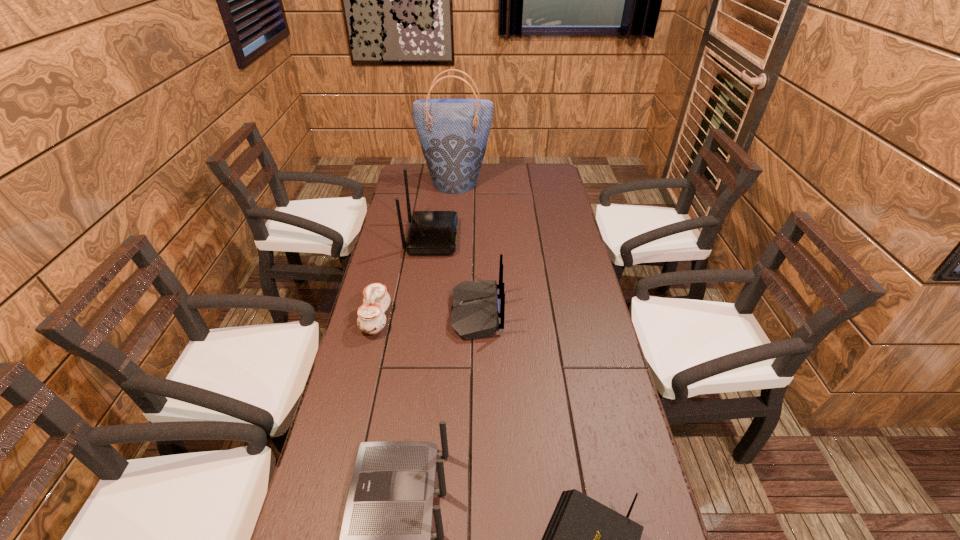
Where is `object present at the far edge`? object present at the far edge is located at coordinates (453, 133).

Identify the location of shopping bag situated at the left edge. (453, 133).

Image resolution: width=960 pixels, height=540 pixels. What are the coordinates of `router at the left edge` in the screenshot? It's located at pos(431,232).

This screenshot has height=540, width=960. Identify the location of chinaware that is at the left edge. (371, 319).

At what (x,y) coordinates should I click in order to perform the action: click on object situated at the far left corner. Please return your answer as a coordinate pair (x, y). The height and width of the screenshot is (540, 960). Looking at the image, I should click on (453, 133).

In order to click on blank space at the far edge of the desktop in this screenshot , I will do `click(500, 167)`.

The image size is (960, 540). In the image, there is a desktop. What are the coordinates of `vacant space at the left edge` in the screenshot? It's located at (333, 409).

At what (x,y) coordinates should I click in order to perform the action: click on vacant space at the right edge of the desktop. Please return your answer as a coordinate pair (x, y). The width and height of the screenshot is (960, 540). Looking at the image, I should click on (577, 335).

The width and height of the screenshot is (960, 540). I want to click on vacant region at the far left corner of the desktop, so click(429, 184).

Locate an element on the screen. vacant space that is in between the tallest object and the second farthest router is located at coordinates (467, 247).